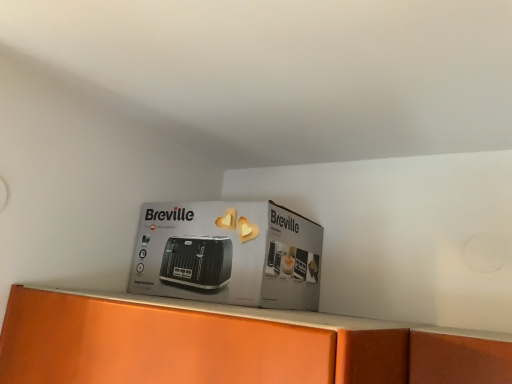
Where is `black plastic toaster at center`? The height and width of the screenshot is (384, 512). black plastic toaster at center is located at coordinates pos(228,344).

What is the approximate width of black plastic toaster at center?

3.63 meters.

What do you see at coordinates (228, 344) in the screenshot? The height and width of the screenshot is (384, 512). I see `black plastic toaster at center` at bounding box center [228, 344].

What do you see at coordinates (228, 254) in the screenshot?
I see `matte black toaster at center` at bounding box center [228, 254].

At what (x,y) coordinates should I click in order to perform the action: click on matte black toaster at center. Please return your answer as a coordinate pair (x, y). Image resolution: width=512 pixels, height=384 pixels. Looking at the image, I should click on (228, 254).

Measure the distance between matte black toaster at center and camera.

matte black toaster at center and camera are 32.74 inches apart.

Locate an element on the screen. The height and width of the screenshot is (384, 512). black plastic toaster at center is located at coordinates (228, 344).

Considering the relative positions of matte black toaster at center and black plastic toaster at center in the image provided, is matte black toaster at center to the left of black plastic toaster at center from the viewer's perspective?

Correct, you'll find matte black toaster at center to the left of black plastic toaster at center.

Does matte black toaster at center come behind black plastic toaster at center?

No, it is in front of black plastic toaster at center.

Is point (236, 296) in front of point (156, 379)?

No.

From the image's perspective, would you say matte black toaster at center is shown under black plastic toaster at center?

Incorrect, from the image's perspective, matte black toaster at center is higher than black plastic toaster at center.

From a real-world perspective, relative to black plastic toaster at center, is matte black toaster at center vertically above or below?

matte black toaster at center is situated higher than black plastic toaster at center in the real world.

Looking at their sizes, would you say matte black toaster at center is wider or thinner than black plastic toaster at center?

Clearly, matte black toaster at center has less width compared to black plastic toaster at center.

Is matte black toaster at center taller or shorter than black plastic toaster at center?

matte black toaster at center is shorter than black plastic toaster at center.

Does matte black toaster at center have a larger size compared to black plastic toaster at center?

Actually, matte black toaster at center might be smaller than black plastic toaster at center.

Would you say matte black toaster at center is inside or outside black plastic toaster at center?

The correct answer is: outside.

Are matte black toaster at center and black plastic toaster at center making contact?

No, matte black toaster at center is not beside black plastic toaster at center.

Is matte black toaster at center facing away from black plastic toaster at center?

Absolutely, matte black toaster at center is directed away from black plastic toaster at center.

What's the angular difference between matte black toaster at center and black plastic toaster at center's facing directions?

They differ by 1.02 degrees in their facing directions.

You are a GUI agent. You are given a task and a screenshot of the screen. Output one action in this format:
    pyautogui.click(x=<x>, y=<y>)
    Task: Click on the home appliance below the matte black toaster at center (from the image's perspective)
    Image resolution: width=512 pixels, height=384 pixels.
    Given the screenshot: What is the action you would take?
    pyautogui.click(x=228, y=344)

Does black plastic toaster at center appear on the right side of matte black toaster at center?

Indeed, black plastic toaster at center is positioned on the right side of matte black toaster at center.

Which object is closer to the camera, black plastic toaster at center or matte black toaster at center?

matte black toaster at center is closer to the camera.

Between point (275, 368) and point (269, 223), which one is positioned behind?

Positioned behind is point (269, 223).

From the image's perspective, which is above, black plastic toaster at center or matte black toaster at center?

From the image's view, matte black toaster at center is above.

From a real-world perspective, who is located higher, black plastic toaster at center or matte black toaster at center?

In real-world perspective, matte black toaster at center is above.

Can you confirm if black plastic toaster at center is wider than matte black toaster at center?

Correct, the width of black plastic toaster at center exceeds that of matte black toaster at center.

Can you confirm if black plastic toaster at center is shorter than matte black toaster at center?

No, black plastic toaster at center is not shorter than matte black toaster at center.

Considering the sizes of objects black plastic toaster at center and matte black toaster at center in the image provided, who is smaller, black plastic toaster at center or matte black toaster at center?

matte black toaster at center.

Can we say black plastic toaster at center lies outside matte black toaster at center?

black plastic toaster at center is positioned outside matte black toaster at center.

Is black plastic toaster at center in contact with matte black toaster at center?

No, black plastic toaster at center is not next to matte black toaster at center.

Could you tell me if black plastic toaster at center is facing matte black toaster at center?

No, black plastic toaster at center is not turned towards matte black toaster at center.

Measure the distance from black plastic toaster at center to matte black toaster at center.

black plastic toaster at center and matte black toaster at center are 7.30 inches apart.

The width and height of the screenshot is (512, 384). In order to click on home appliance that is behind the matte black toaster at center in this screenshot , I will do `click(228, 344)`.

In order to click on home appliance behind the matte black toaster at center in this screenshot , I will do `click(228, 344)`.

The image size is (512, 384). In order to click on cardboard box located above the black plastic toaster at center (from a real-world perspective) in this screenshot , I will do `click(228, 254)`.